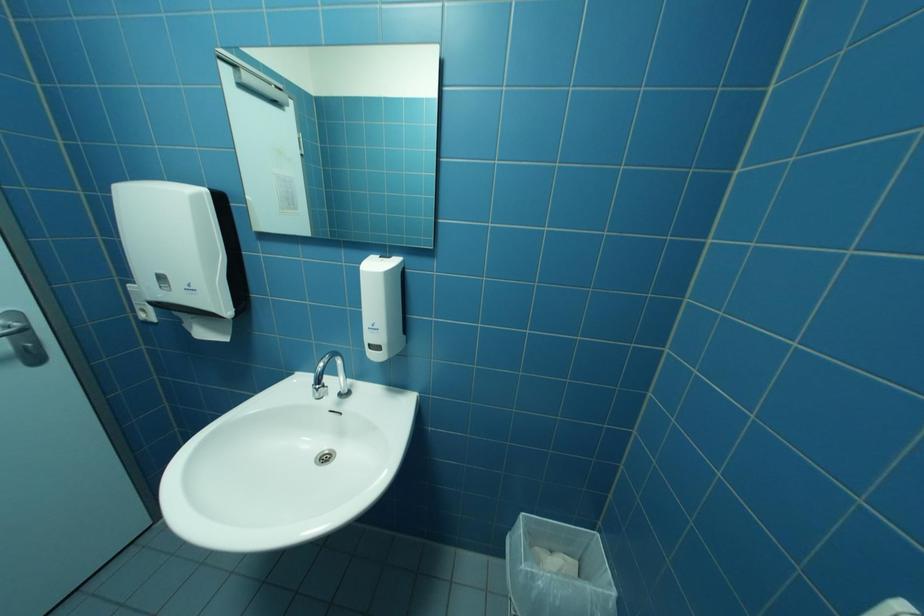
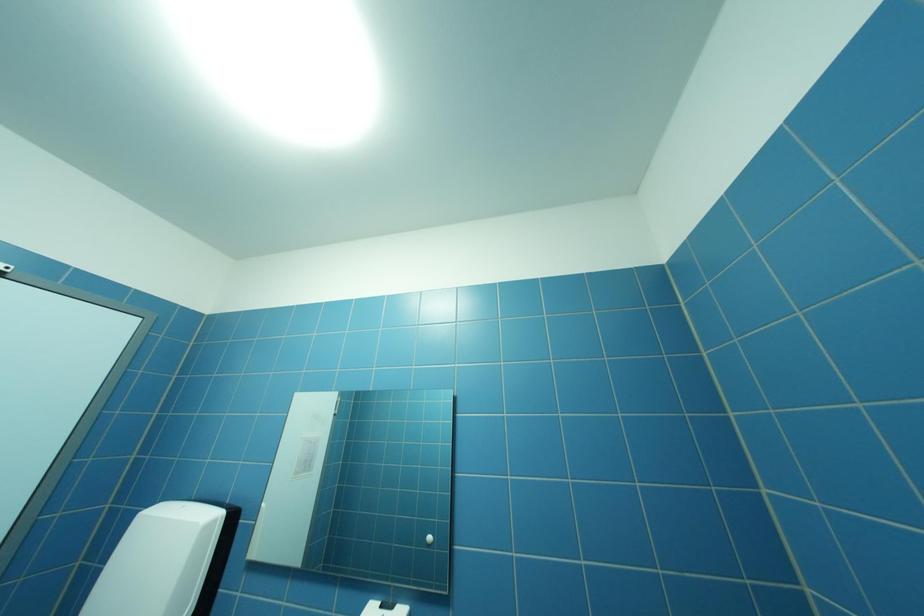
Question: The images are taken continuously from a first-person perspective. In which direction is your viewpoint rotating?

Choices:
 (A) Left
 (B) Right
 (C) Up
 (D) Down

Answer: (C)